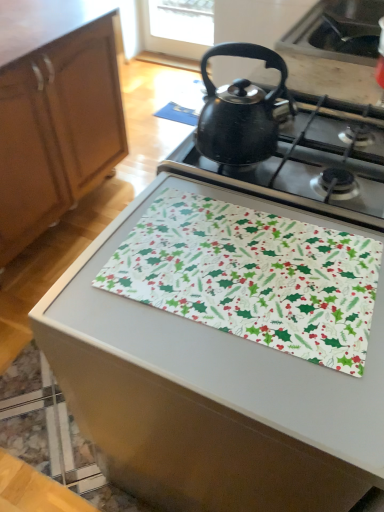
Question: Is black matte kettle at upper center taller or shorter than black matte sink at upper right?

Choices:
 (A) short
 (B) tall

Answer: (B)

Question: Considering the relative positions of black matte kettle at upper center and black matte sink at upper right in the image provided, is black matte kettle at upper center to the left or to the right of black matte sink at upper right?

Choices:
 (A) left
 (B) right

Answer: (A)

Question: Which object is positioned closest to the wooden cabinet at left?

Choices:
 (A) black matte kettle at upper center
 (B) black matte sink at upper right
 (C) white fabric with holiday pattern at center
 (D) white fabric placemat at center
 (E) black matte kettle at upper center

Answer: (B)

Question: Which of these objects is positioned farthest from the white fabric with holiday pattern at center?

Choices:
 (A) white fabric placemat at center
 (B) black matte kettle at upper center
 (C) wooden cabinet at left
 (D) black matte kettle at upper center
 (E) black matte sink at upper right

Answer: (C)